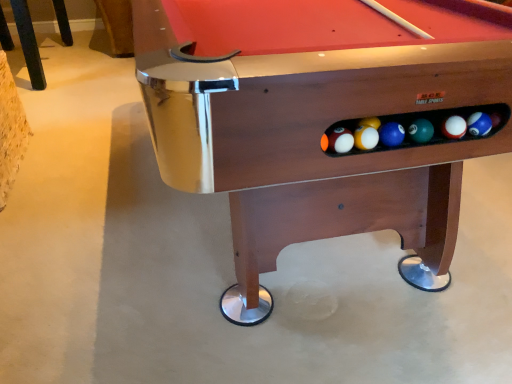
Question: Is wooden chair leg at upper left taller or shorter than wooden billiard table at center?

Choices:
 (A) short
 (B) tall

Answer: (A)

Question: Is wooden chair leg at upper left wider or thinner than wooden billiard table at center?

Choices:
 (A) wide
 (B) thin

Answer: (B)

Question: From the image's perspective, is wooden chair leg at upper left positioned above or below wooden billiard table at center?

Choices:
 (A) below
 (B) above

Answer: (B)

Question: In the image, is wooden billiard table at center positioned in front of or behind wooden chair leg at upper left?

Choices:
 (A) front
 (B) behind

Answer: (A)

Question: From a real-world perspective, relative to wooden chair leg at upper left, is wooden billiard table at center vertically above or below?

Choices:
 (A) below
 (B) above

Answer: (B)

Question: Is wooden billiard table at center taller or shorter than wooden chair leg at upper left?

Choices:
 (A) tall
 (B) short

Answer: (A)

Question: Is wooden billiard table at center to the left or to the right of wooden chair leg at upper left in the image?

Choices:
 (A) right
 (B) left

Answer: (A)